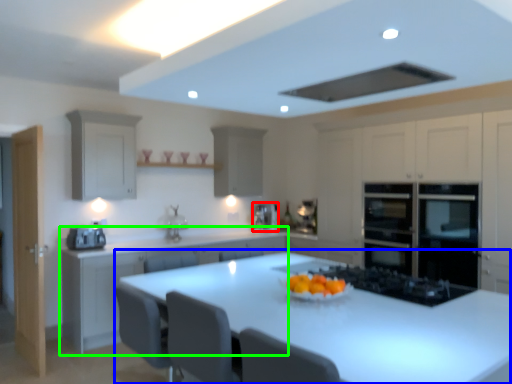
Question: Based on their relative distances, which object is nearer to coffee machine (highlighted by a red box)? Choose from table (highlighted by a blue box) and cabinetry (highlighted by a green box).

Choices:
 (A) table
 (B) cabinetry

Answer: (B)